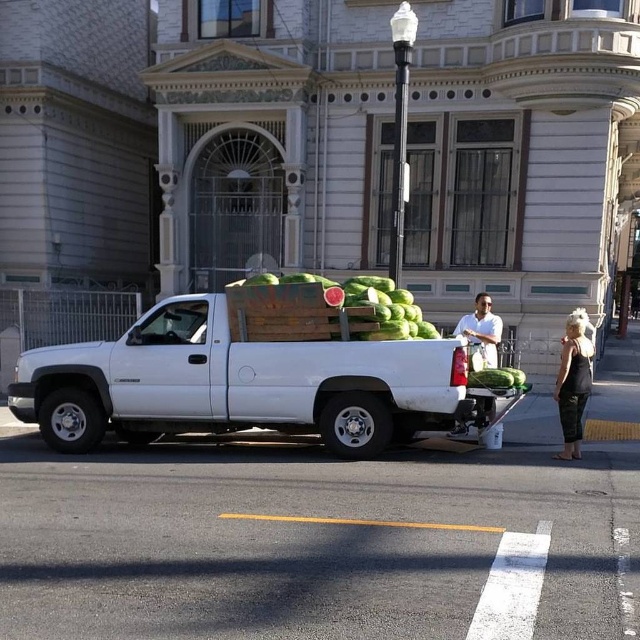
Question: Which object appears closest to the camera in this image?

Choices:
 (A) white matte shirt at center
 (B) black fabric dress at right
 (C) green matte watermelons at center

Answer: (C)

Question: Is the position of green matte watermelons at center more distant than that of white matte shirt at center?

Choices:
 (A) yes
 (B) no

Answer: (B)

Question: Considering the real-world distances, which object is closest to the green matte watermelons at center?

Choices:
 (A) white matte truck at center
 (B) black fabric dress at right
 (C) white matte shirt at center

Answer: (A)

Question: In this image, where is green matte watermelons at center located relative to black fabric dress at right?

Choices:
 (A) right
 (B) left

Answer: (B)

Question: Which object is farther from the camera taking this photo?

Choices:
 (A) black fabric dress at right
 (B) green matte watermelons at center

Answer: (A)

Question: Is green matte watermelons at center to the right of black fabric dress at right from the viewer's perspective?

Choices:
 (A) yes
 (B) no

Answer: (B)